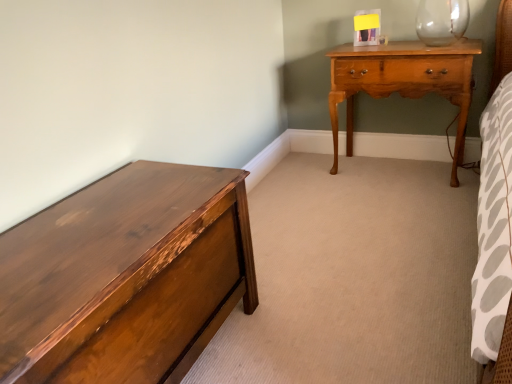
This screenshot has width=512, height=384. What are the coordinates of `blank space to the left of light brown wood nightstand at upper right` in the screenshot? It's located at (315, 182).